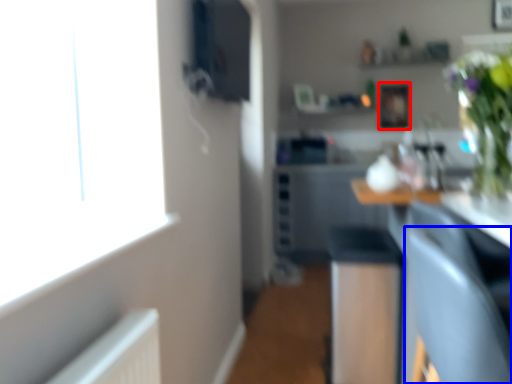
Question: Among these objects, which one is farthest to the camera, picture frame (highlighted by a red box) or armchair (highlighted by a blue box)?

Choices:
 (A) picture frame
 (B) armchair

Answer: (A)